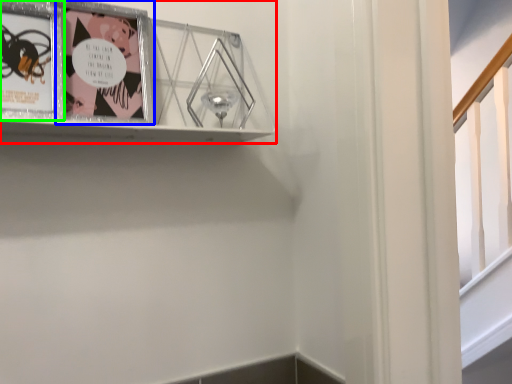
Question: Which object is the farthest from picture frame (highlighted by a red box)? Choose among these: picture frame (highlighted by a blue box) or picture frame (highlighted by a green box).

Choices:
 (A) picture frame
 (B) picture frame

Answer: (B)